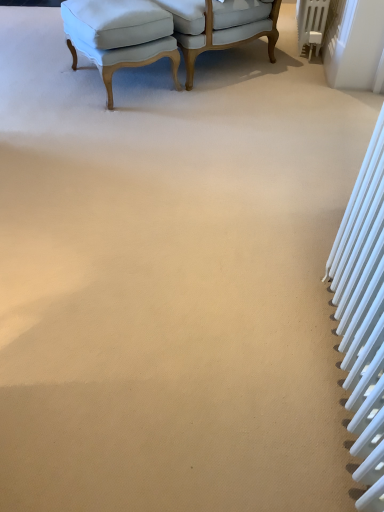
Image resolution: width=384 pixels, height=512 pixels. Find the location of `vacant space to the left of light blue fabric ottoman at upper left, the 1th chair positioned from the left`. vacant space to the left of light blue fabric ottoman at upper left, the 1th chair positioned from the left is located at coordinates (43, 79).